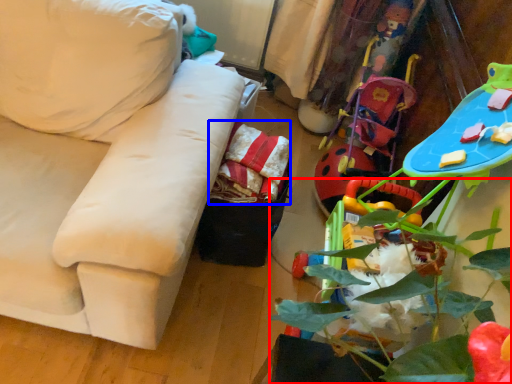
Question: Which object is closer to the camera taking this photo, plant (highlighted by a red box) or material (highlighted by a blue box)?

Choices:
 (A) plant
 (B) material

Answer: (A)